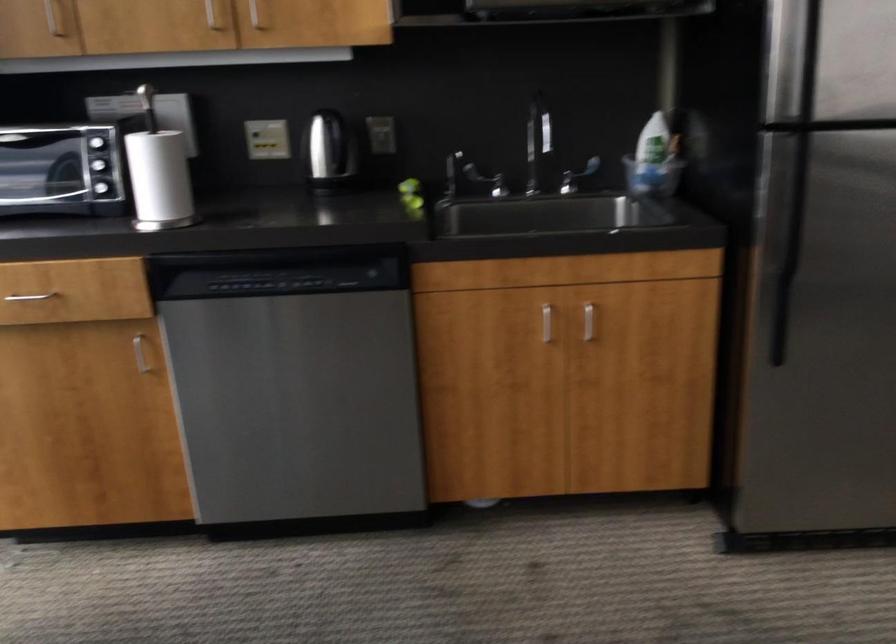
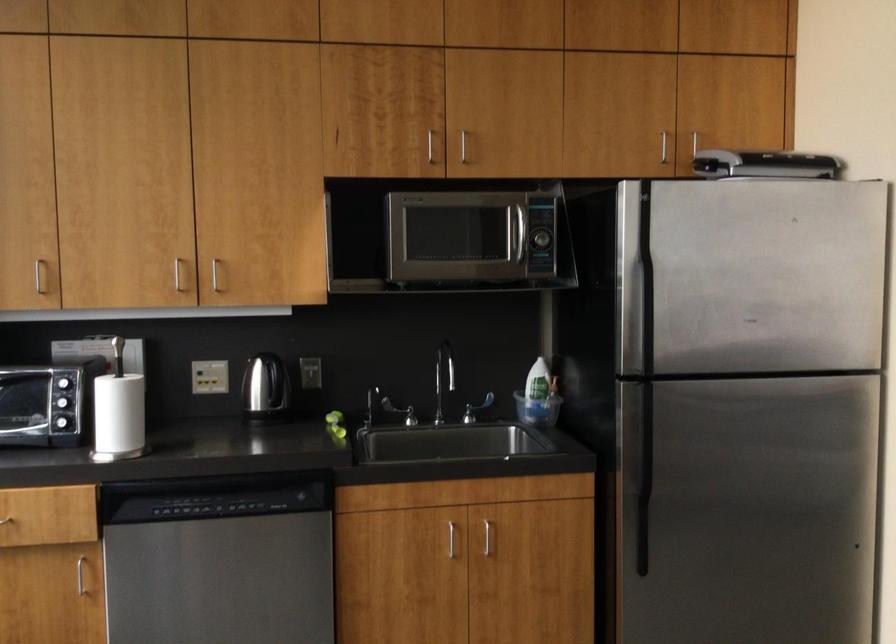
Where in the second image is the point corresponding to [541,129] from the first image?

(444, 371)